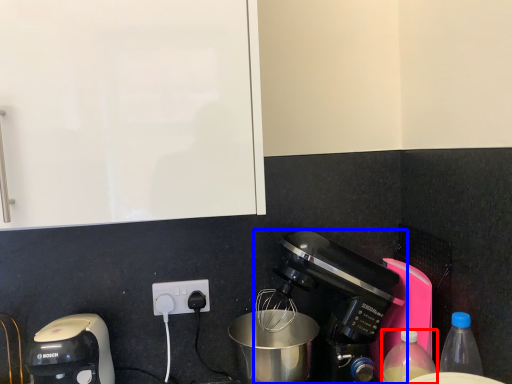
Question: Which of the following is the farthest to the observer, bottle (highlighted by a red box) or coffee maker (highlighted by a blue box)?

Choices:
 (A) bottle
 (B) coffee maker

Answer: (B)